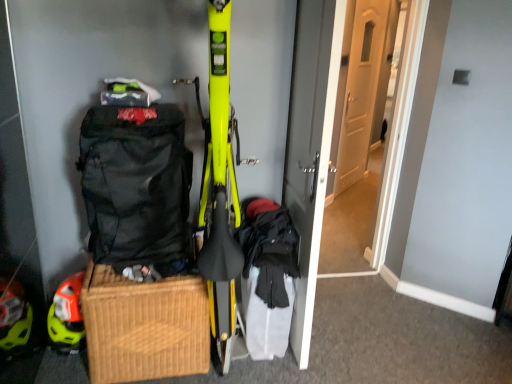
Question: Which direction should I rotate to look at white wooden door at center, which appears as the second door when viewed from the left?

Choices:
 (A) left
 (B) right

Answer: (B)

Question: Is woven brown picnic basket at lower left shorter than orange matte helmet at lower left?

Choices:
 (A) no
 (B) yes

Answer: (A)

Question: Is woven brown picnic basket at lower left further to camera compared to orange matte helmet at lower left?

Choices:
 (A) no
 (B) yes

Answer: (A)

Question: Is orange matte helmet at lower left located within woven brown picnic basket at lower left?

Choices:
 (A) no
 (B) yes

Answer: (A)

Question: Considering the relative sizes of woven brown picnic basket at lower left and orange matte helmet at lower left in the image provided, is woven brown picnic basket at lower left wider than orange matte helmet at lower left?

Choices:
 (A) no
 (B) yes

Answer: (B)

Question: Is woven brown picnic basket at lower left not near orange matte helmet at lower left?

Choices:
 (A) yes
 (B) no

Answer: (B)

Question: From a real-world perspective, is woven brown picnic basket at lower left located beneath orange matte helmet at lower left?

Choices:
 (A) no
 (B) yes

Answer: (A)

Question: Is the depth of black fabric backpack at left less than that of white wooden door at center, which appears as the first door when viewed from the right?

Choices:
 (A) yes
 (B) no

Answer: (A)

Question: Can you confirm if black fabric backpack at left is thinner than white wooden door at center, which appears as the first door when viewed from the right?

Choices:
 (A) yes
 (B) no

Answer: (B)

Question: Does black fabric backpack at left come behind white wooden door at center, which appears as the second door when viewed from the left?

Choices:
 (A) yes
 (B) no

Answer: (B)

Question: Can you confirm if black fabric backpack at left is shorter than white wooden door at center, which appears as the second door when viewed from the left?

Choices:
 (A) yes
 (B) no

Answer: (A)

Question: Is black fabric backpack at left taller than white wooden door at center, which appears as the first door when viewed from the right?

Choices:
 (A) no
 (B) yes

Answer: (A)

Question: Is black fabric backpack at left looking in the opposite direction of white wooden door at center, which appears as the second door when viewed from the left?

Choices:
 (A) no
 (B) yes

Answer: (A)

Question: From the image's perspective, is orange matte helmet at lower left on white wooden door at center, which appears as the first door when viewed from the right?

Choices:
 (A) no
 (B) yes

Answer: (A)